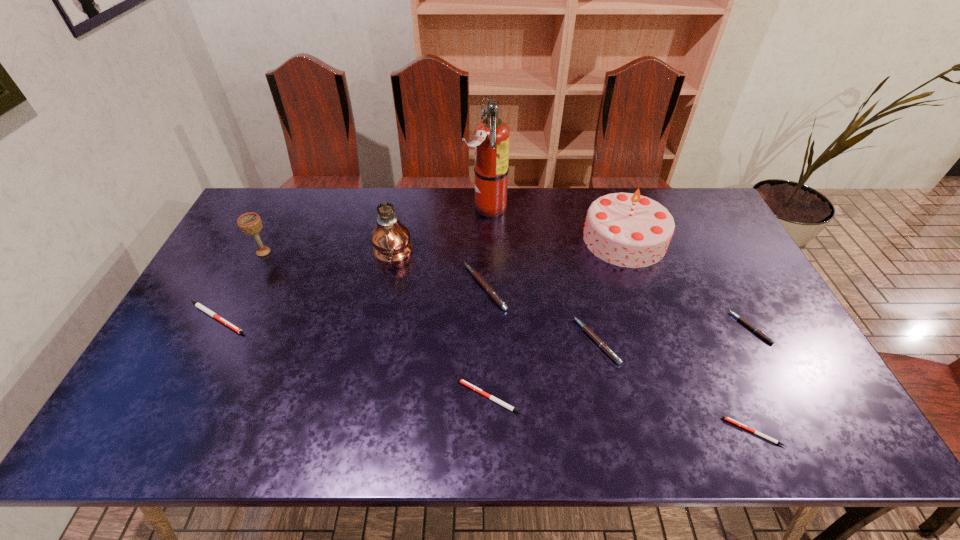
Identify the location of the second smallest pink pen. (584, 327).

At what (x,y) coordinates should I click in order to perform the action: click on the leftmost white pen. Please return your answer as a coordinate pair (x, y). The image size is (960, 540). Looking at the image, I should click on (198, 305).

Where is `the biggest white pen`? This screenshot has width=960, height=540. the biggest white pen is located at coordinates click(x=198, y=305).

Locate an element on the screen. Image resolution: width=960 pixels, height=540 pixels. the rightmost pen is located at coordinates (740, 318).

Locate an element on the screen. The height and width of the screenshot is (540, 960). the smallest pink pen is located at coordinates (740, 318).

The width and height of the screenshot is (960, 540). Find the location of `the second nearest white pen`. the second nearest white pen is located at coordinates point(500,402).

Identify the location of the second nearest pen. (500, 402).

The image size is (960, 540). In order to click on the nearest white pen in this screenshot , I will do `click(725, 418)`.

You are a GUI agent. You are given a task and a screenshot of the screen. Output one action in this format:
    pyautogui.click(x=<x>, y=<y>)
    Task: Click on the nearest object
    
    Given the screenshot: What is the action you would take?
    pyautogui.click(x=725, y=418)

The height and width of the screenshot is (540, 960). Find the location of `vacant space situated from the nozzle of the fire extinguisher`. vacant space situated from the nozzle of the fire extinguisher is located at coordinates 352,207.